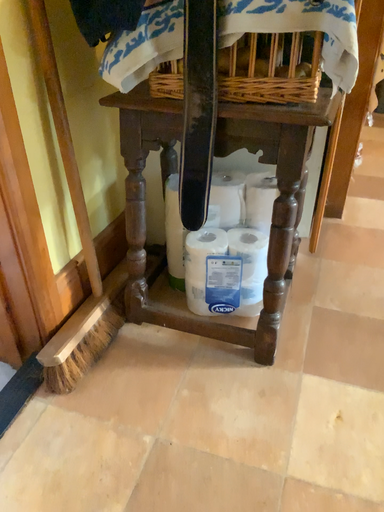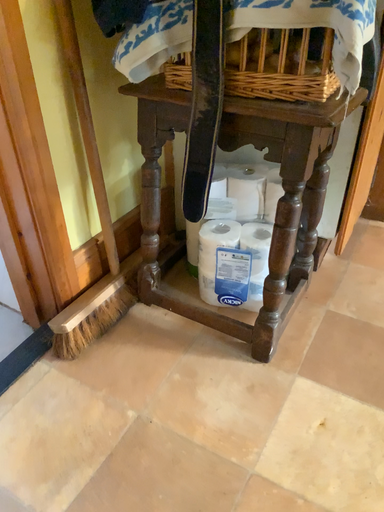
Question: Which way did the camera rotate in the video?

Choices:
 (A) rotated left
 (B) rotated right

Answer: (A)